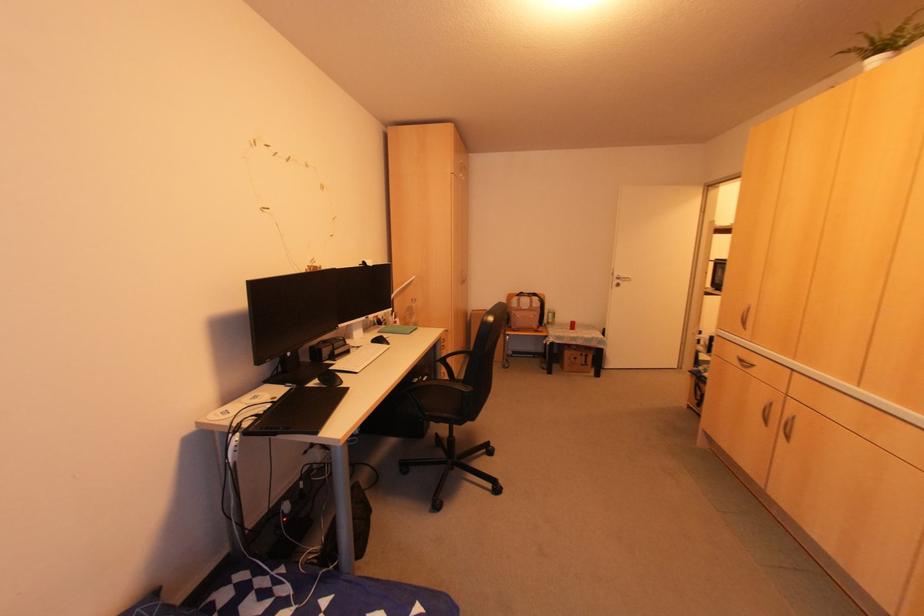
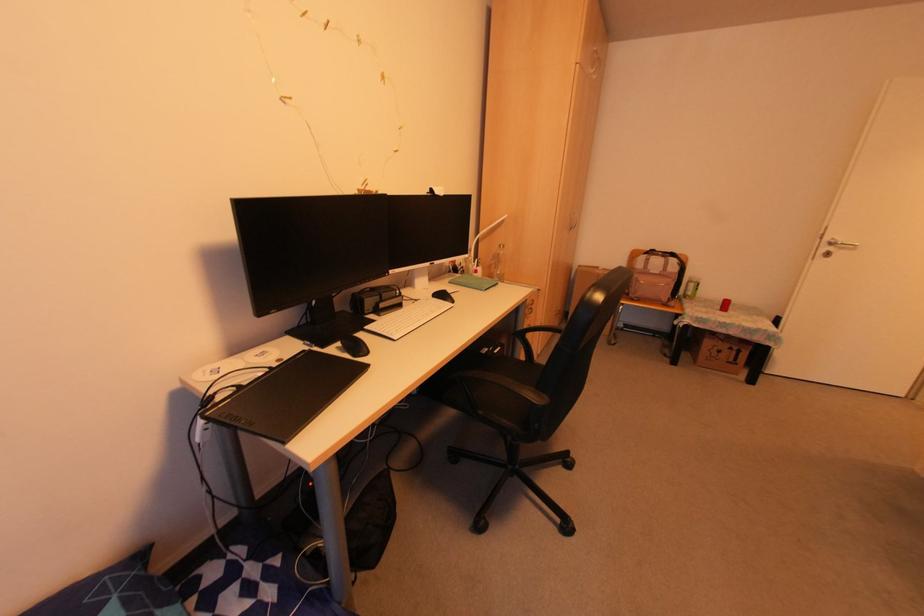
The point at (412, 301) is marked in the first image. Where is the corresponding point in the second image?

(502, 246)